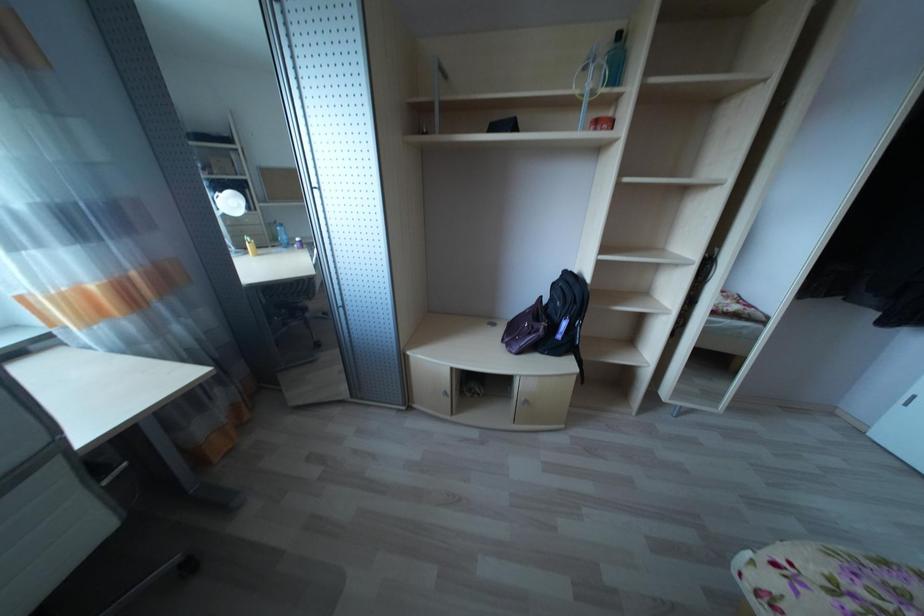
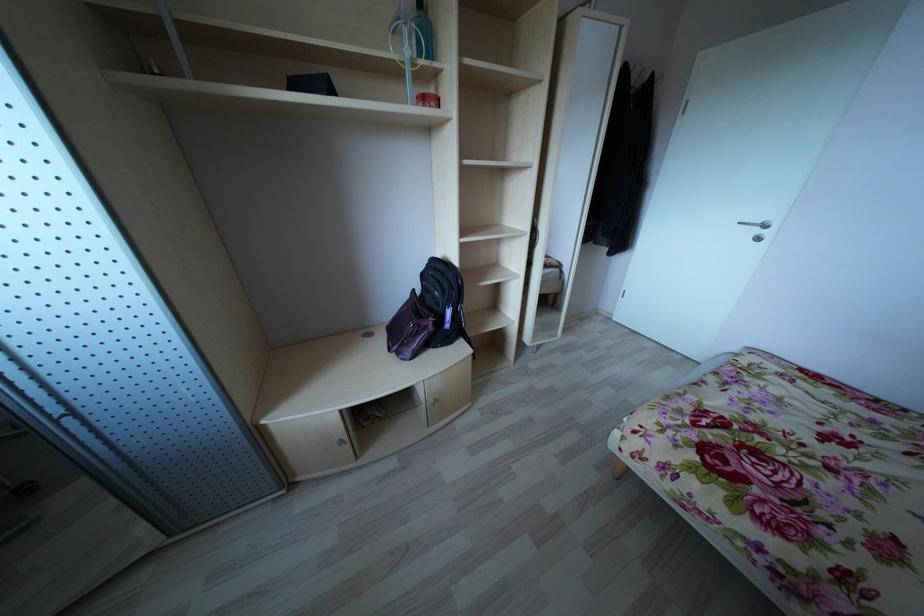
Question: The first image is from the beginning of the video and the second image is from the end. How did the camera likely rotate when shooting the video?

Choices:
 (A) Left
 (B) Right
 (C) Up
 (D) Down

Answer: (B)